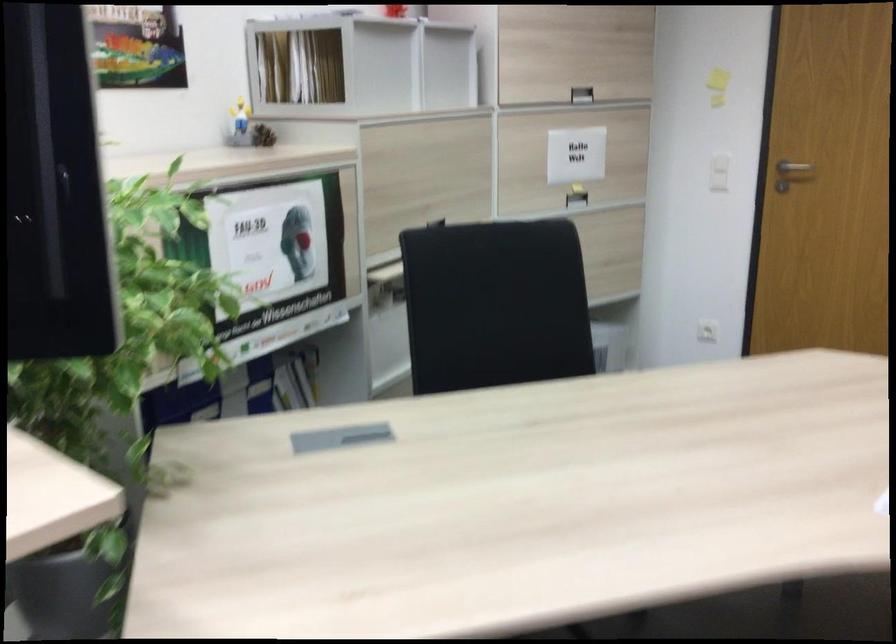
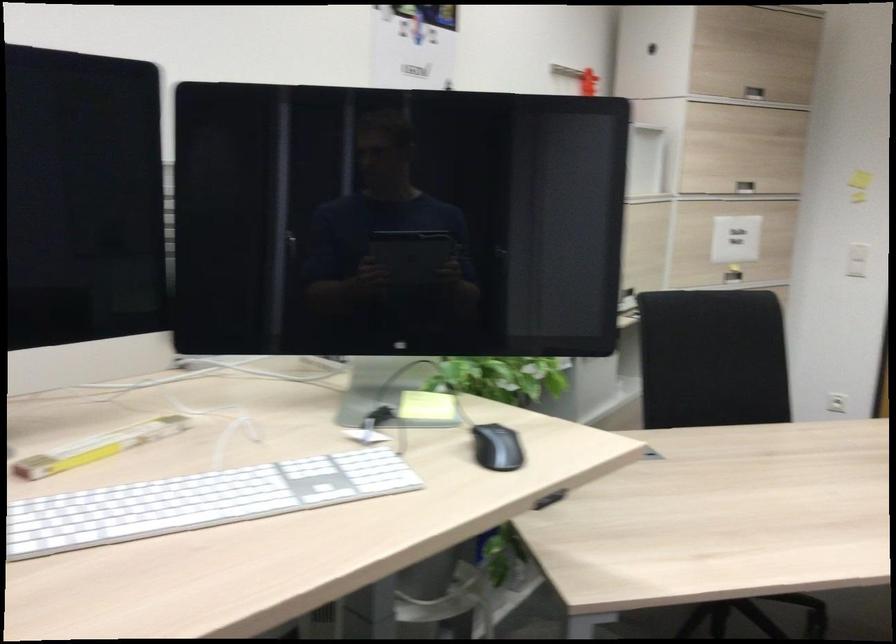
In the second image, find the point that corresponds to point 572,95 in the first image.

(745, 187)